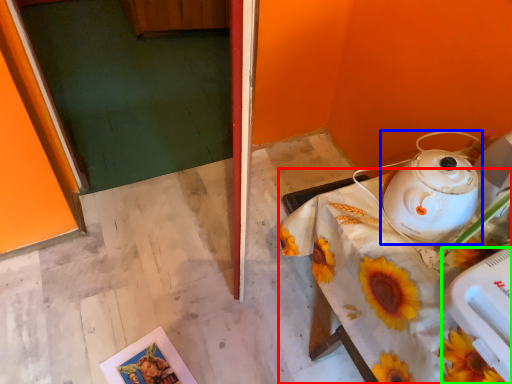
Question: Based on their relative distances, which object is farther from table (highlighted by a red box)? Choose from kettle (highlighted by a blue box) and appliance (highlighted by a green box).

Choices:
 (A) kettle
 (B) appliance

Answer: (B)